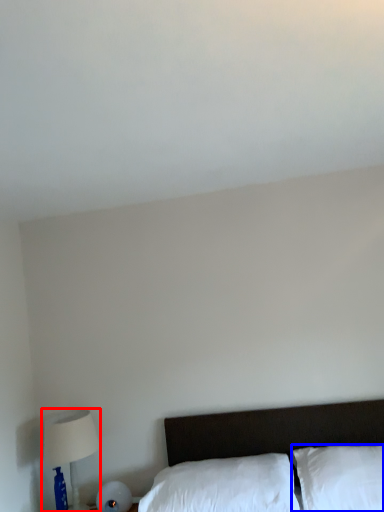
Question: Which object appears closest to the camera in this image, table lamp (highlighted by a red box) or pillow (highlighted by a blue box)?

Choices:
 (A) table lamp
 (B) pillow

Answer: (B)